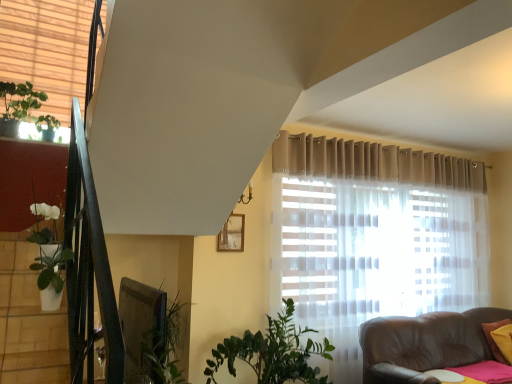
Question: From a real-world perspective, is beige fabric blinds at upper left positioned above or below white glossy pot at left?

Choices:
 (A) above
 (B) below

Answer: (A)

Question: Looking at their shapes, would you say beige fabric blinds at upper left is wider or thinner than white glossy pot at left?

Choices:
 (A) thin
 (B) wide

Answer: (A)

Question: Which is farther from the green matte plant at upper left?

Choices:
 (A) beige fabric blinds at upper left
 (B) wooden frame at upper center
 (C) yellow fabric pillow at lower right
 (D) white glossy pot at left

Answer: (C)

Question: Considering the real-world distances, which object is farthest from the white glossy pot at left?

Choices:
 (A) green matte plant at upper left
 (B) yellow fabric pillow at lower right
 (C) beige fabric blinds at upper left
 (D) wooden frame at upper center

Answer: (B)